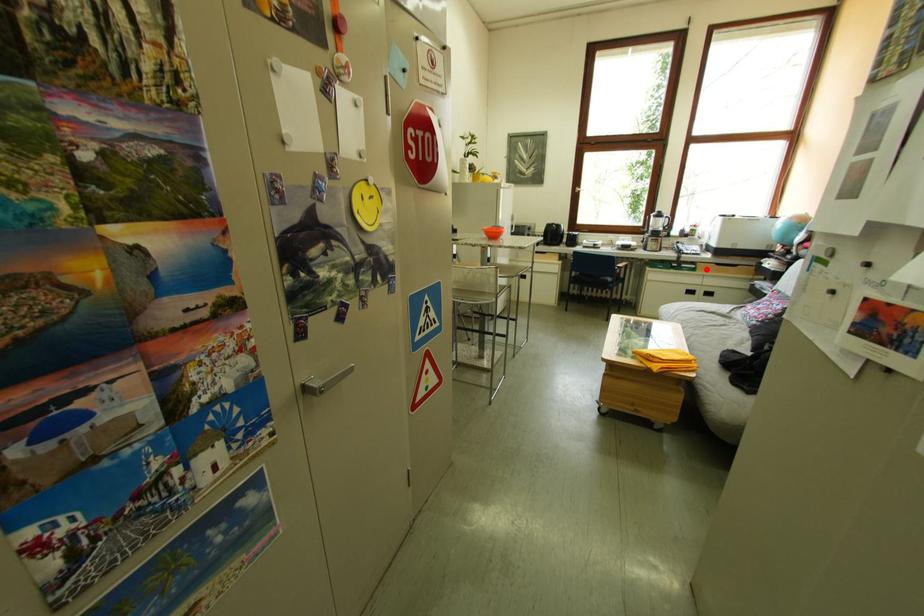
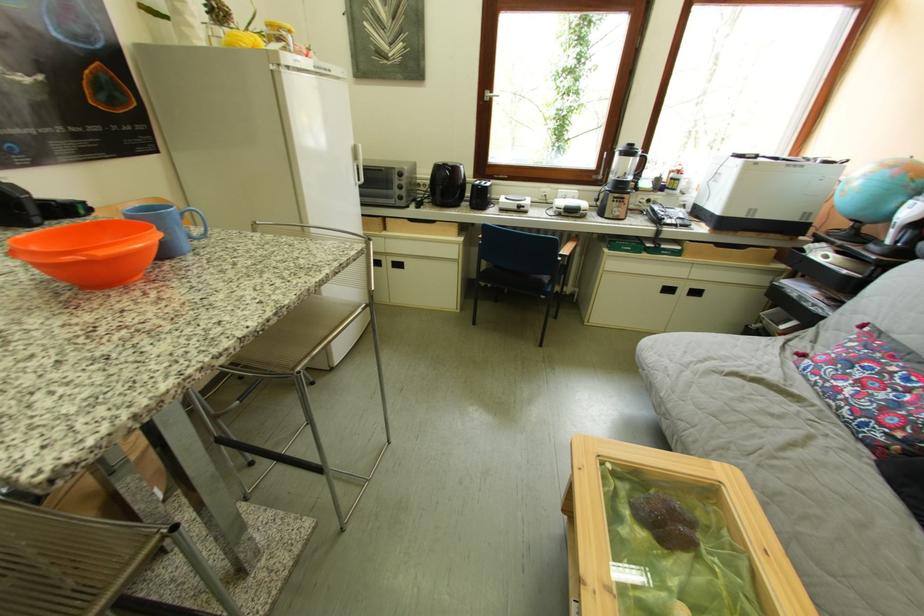
The point at the highlighted location is marked in the first image. Where is the corresponding point in the second image?

(690, 251)